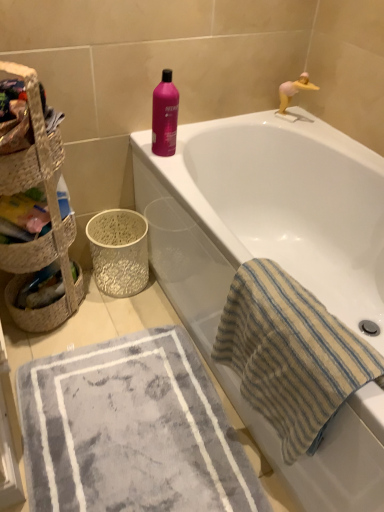
Locate an element on the screen. The height and width of the screenshot is (512, 384). vacant area that is in front of woven straw basket at left, the second basket viewed from the top is located at coordinates (46, 350).